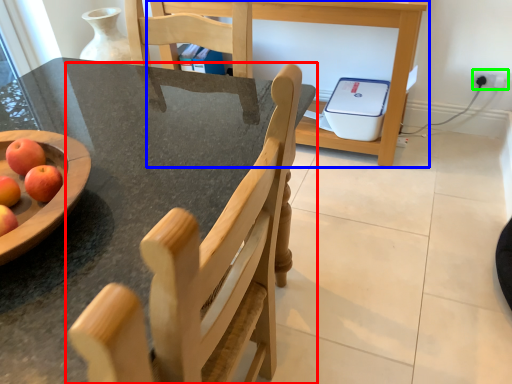
Question: Estimate the real-world distances between objects in this image. Which object is farther from chair (highlighted by a red box), table (highlighted by a blue box) or electric outlet (highlighted by a green box)?

Choices:
 (A) table
 (B) electric outlet

Answer: (B)